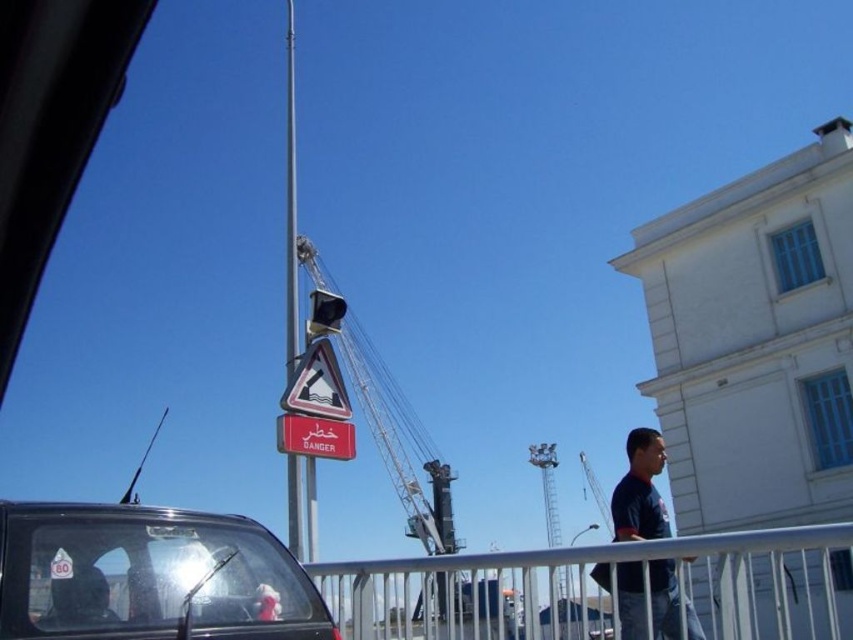
Question: Which point appears farthest from the camera in this image?

Choices:
 (A) (326, 410)
 (B) (318, 637)
 (C) (698, 563)

Answer: (C)

Question: Does metallic pole at center come in front of red matte sign at center?

Choices:
 (A) yes
 (B) no

Answer: (A)

Question: Which point is closer to the camera?

Choices:
 (A) (656, 611)
 (B) (286, 344)

Answer: (A)

Question: Does clear glass car at lower left appear over dark blue t-shirt at center?

Choices:
 (A) yes
 (B) no

Answer: (A)

Question: Does dark blue t-shirt at center have a lesser width compared to reflective plastic triangle at center?

Choices:
 (A) yes
 (B) no

Answer: (B)

Question: Which of the following is the farthest from the observer?

Choices:
 (A) clear glass car at lower left
 (B) white metallic rail at center
 (C) dark blue t-shirt at center
 (D) reflective plastic triangle at center

Answer: (D)